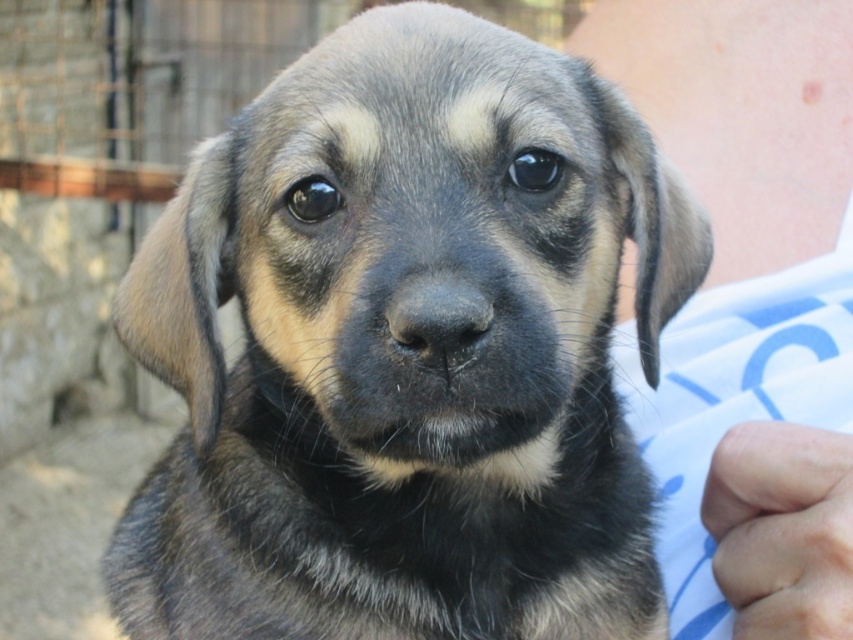
You are a photographer trying to capture the puppy and the background. You notice two areas of the image labeled as smooth skin at upper right and skinny flesh at lower right. Which of these areas is positioned higher up in the image?

The smooth skin at upper right is positioned higher up in the image than the skinny flesh at lower right.

You are a photographer trying to capture the puppy and the background elements. You notice the smooth skin at upper right and the skinny flesh at lower right in your frame. Which object is positioned more to the right side of the image?

The smooth skin at upper right is positioned more to the right side of the image compared to the skinny flesh at lower right.

You are a photographer trying to capture the puppy in the image. You notice two points marked in the scene. The first point is at coordinate point [751,545] and the second at point [767,460]. Which point is closer to the camera?

Point [767,460] is closer to the camera because the point [751,545] is behind it.